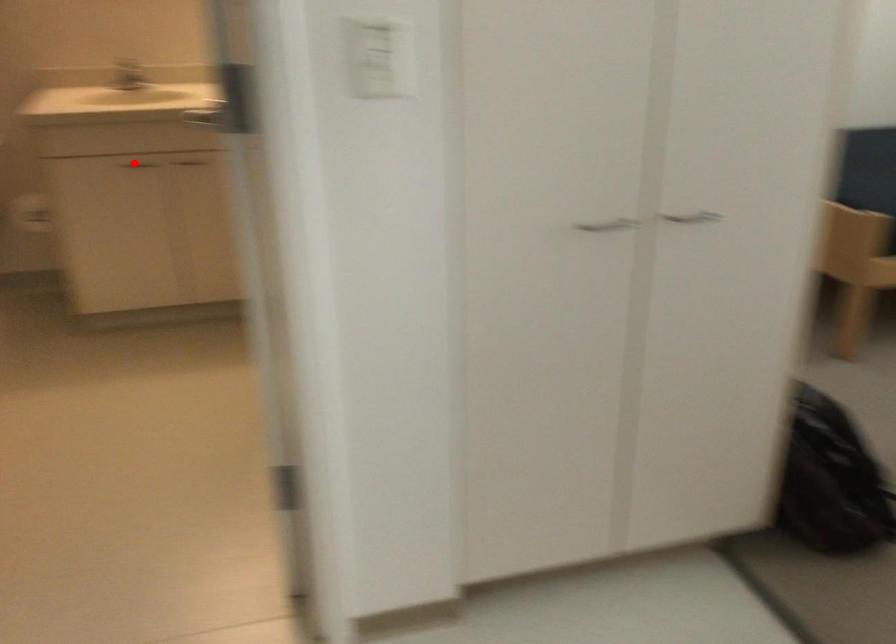
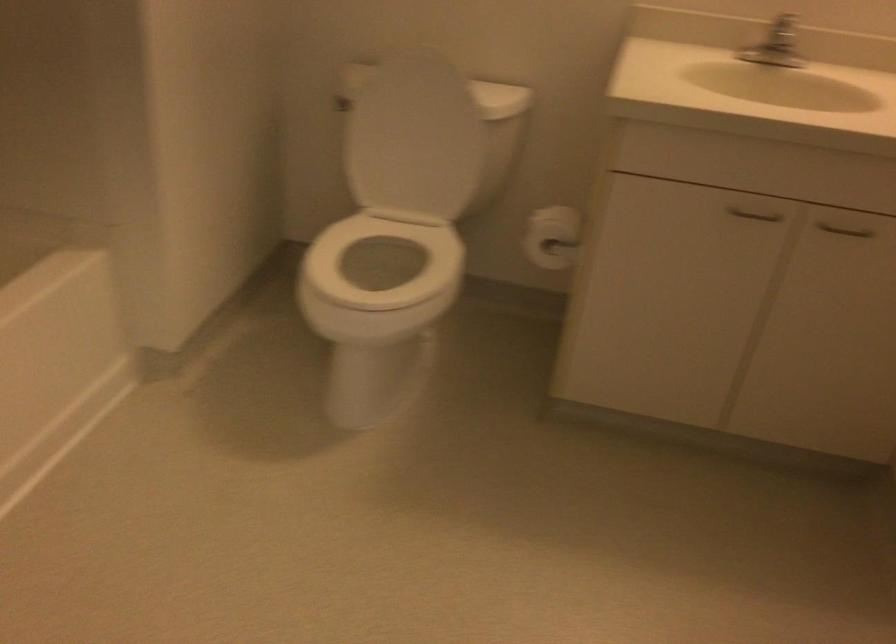
Find the pixel in the second image that matches the highlighted location in the first image.

(754, 214)